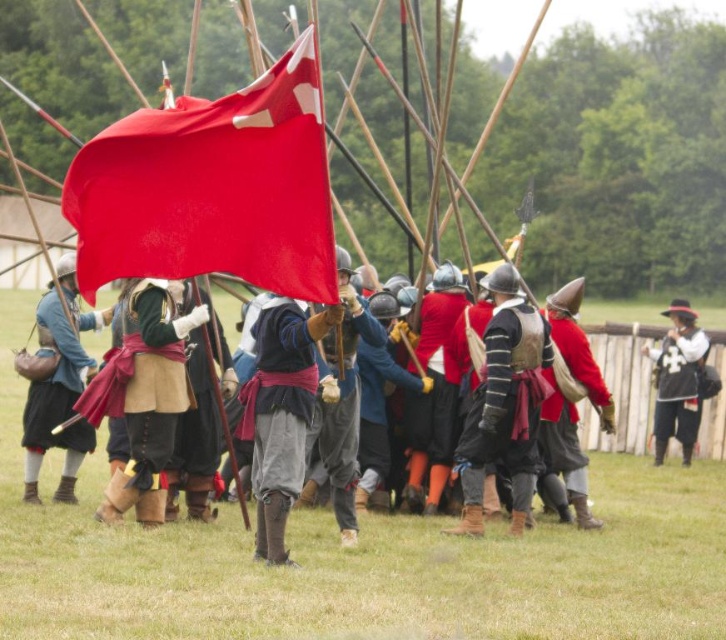
You are a historian examining the image and need to determine the relative sizes of the objects in the scene. Which object, the smooth red flag at center or the matte leather bag at center, is wider?

The smooth red flag at center is less wide than the matte leather bag at center, so the matte leather bag at center is wider.

You are a photographer positioned at the edge of the historical reenactment scene. You need to capture a photo that includes both the smooth red flag at center and the matte leather bag at center. Given that your camera has a maximum focus range of 20 feet, will you be able to include both objects in the same frame without moving your position?

The smooth red flag at center and the matte leather bag at center are 21.43 feet apart from each other. Since your camera can only focus up to 20 feet, you won cannot include both objects in the same frame without moving closer or adjusting your position.

You are a photographer positioned at the back of the procession. You want to capture both the matte red flag at center and the red velvet hat at center in the same frame. Which object should you adjust your camera angle to focus on first to ensure both are visible?

The matte red flag at center is much taller than the red velvet hat at center, so you should focus on the taller matte red flag at center first to ensure it fits in the frame, then adjust for the smaller red velvet hat at center.